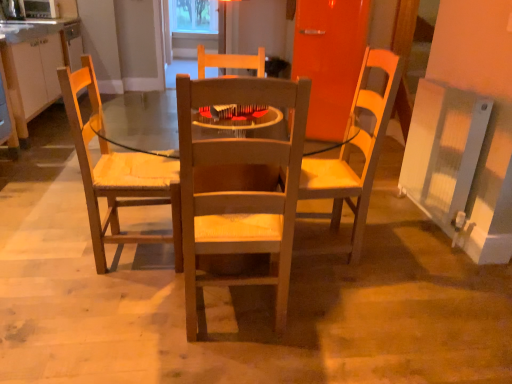
Question: Is transparent plastic window screen at upper center smaller than metallic silver microwave oven at upper left?

Choices:
 (A) no
 (B) yes

Answer: (A)

Question: Is transparent plastic window screen at upper center beside metallic silver microwave oven at upper left?

Choices:
 (A) yes
 (B) no

Answer: (B)

Question: Can you confirm if transparent plastic window screen at upper center is bigger than metallic silver microwave oven at upper left?

Choices:
 (A) yes
 (B) no

Answer: (A)

Question: Is transparent plastic window screen at upper center looking in the opposite direction of metallic silver microwave oven at upper left?

Choices:
 (A) yes
 (B) no

Answer: (B)

Question: Considering the relative sizes of transparent plastic window screen at upper center and metallic silver microwave oven at upper left in the image provided, is transparent plastic window screen at upper center taller than metallic silver microwave oven at upper left?

Choices:
 (A) no
 (B) yes

Answer: (B)

Question: In terms of width, does metallic silver microwave oven at upper left look wider or thinner when compared to matte white cabinets at left?

Choices:
 (A) thin
 (B) wide

Answer: (A)

Question: Choose the correct answer: Is metallic silver microwave oven at upper left inside matte white cabinets at left or outside it?

Choices:
 (A) outside
 (B) inside

Answer: (A)

Question: Considering the positions of metallic silver microwave oven at upper left and matte white cabinets at left in the image, is metallic silver microwave oven at upper left bigger or smaller than matte white cabinets at left?

Choices:
 (A) small
 (B) big

Answer: (A)

Question: Would you say metallic silver microwave oven at upper left is to the left or to the right of matte white cabinets at left in the picture?

Choices:
 (A) left
 (B) right

Answer: (A)

Question: Is transparent plastic window screen at upper center wider or thinner than metallic silver microwave oven at upper left?

Choices:
 (A) wide
 (B) thin

Answer: (B)

Question: Is transparent plastic window screen at upper center in front of or behind metallic silver microwave oven at upper left in the image?

Choices:
 (A) front
 (B) behind

Answer: (B)

Question: Is transparent plastic window screen at upper center inside the boundaries of metallic silver microwave oven at upper left, or outside?

Choices:
 (A) outside
 (B) inside

Answer: (A)

Question: From the image's perspective, relative to metallic silver microwave oven at upper left, is transparent plastic window screen at upper center above or below?

Choices:
 (A) below
 (B) above

Answer: (B)

Question: From the image's perspective, is wooden chair at center above or below wooden chair at left?

Choices:
 (A) above
 (B) below

Answer: (B)

Question: In the image, is wooden chair at center positioned in front of or behind wooden chair at left?

Choices:
 (A) behind
 (B) front

Answer: (B)